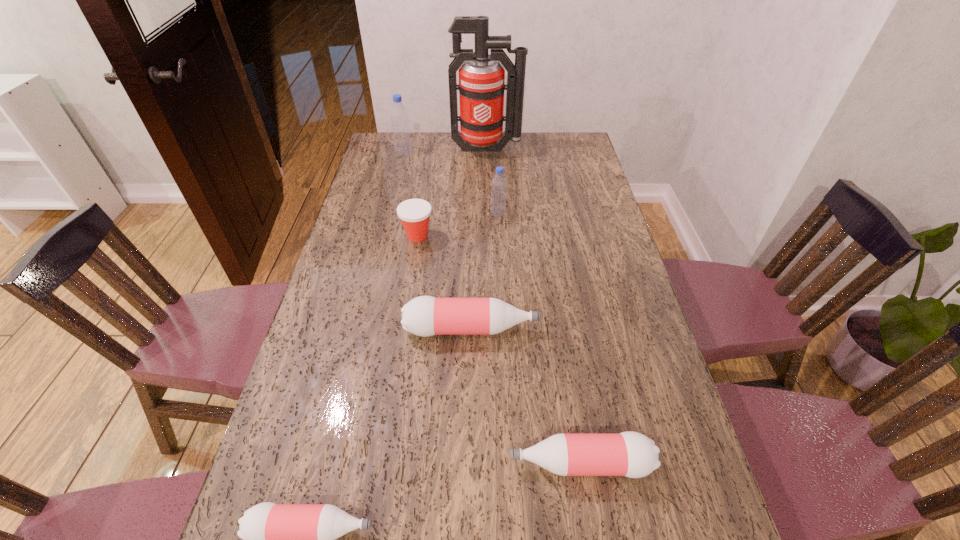
Find the location of `fire extinguisher present at the far edge`. fire extinguisher present at the far edge is located at coordinates (481, 87).

I want to click on bottle that is positioned at the far edge, so click(399, 116).

Identify the location of object present at the left edge. The width and height of the screenshot is (960, 540). (399, 116).

The width and height of the screenshot is (960, 540). In order to click on object at the right edge in this screenshot , I will do `click(631, 454)`.

At what (x,y) coordinates should I click in order to perform the action: click on object at the far left corner. Please return your answer as a coordinate pair (x, y). This screenshot has height=540, width=960. Looking at the image, I should click on (399, 116).

The height and width of the screenshot is (540, 960). I want to click on free spot at the far edge of the desktop, so click(431, 133).

Where is `free space at the left edge of the desktop`? The width and height of the screenshot is (960, 540). free space at the left edge of the desktop is located at coordinates 362,184.

Locate an element on the screen. The height and width of the screenshot is (540, 960). vacant space at the right edge of the desktop is located at coordinates (598, 192).

At what (x,y) coordinates should I click in order to perform the action: click on empty space between the Dixie cup and the biggest pink bottle. Please return your answer as a coordinate pair (x, y). Looking at the image, I should click on (444, 282).

Where is `free spot between the Dixie cup and the bigger blue bottle`? free spot between the Dixie cup and the bigger blue bottle is located at coordinates (411, 194).